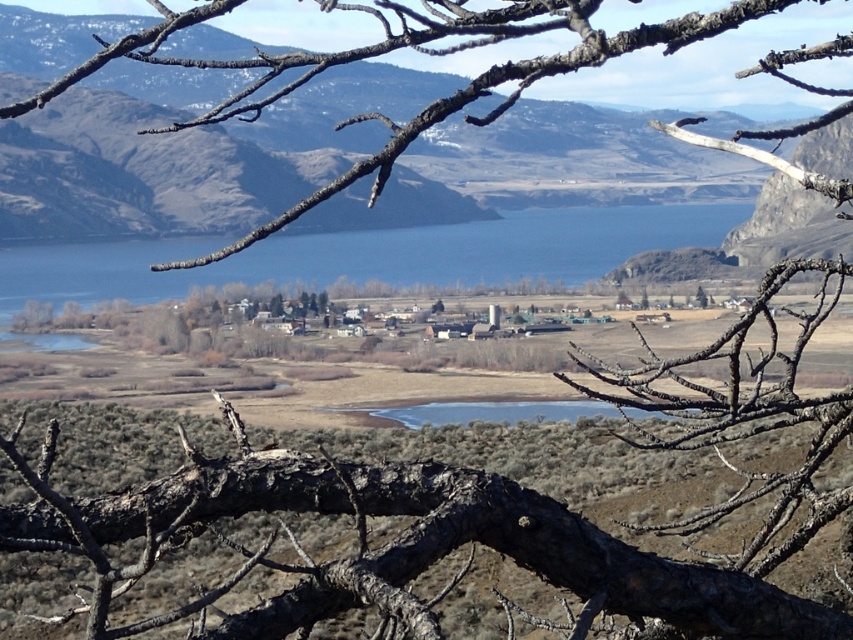
Question: Which of the following is the farthest from the observer?

Choices:
 (A) (165, 291)
 (B) (399, 419)
 (C) (354, 573)

Answer: (A)

Question: In this image, where is dark brown bark at center located relative to brown rough branch at upper center?

Choices:
 (A) left
 (B) right

Answer: (A)

Question: Which point is closer to the camera?

Choices:
 (A) (461, 26)
 (B) (419, 417)

Answer: (A)

Question: Is dark brown bark at center closer to camera compared to blue water at center?

Choices:
 (A) no
 (B) yes

Answer: (B)

Question: Which point appears closest to the camera in this image?

Choices:
 (A) (186, 60)
 (B) (688, 628)
 (C) (32, 262)

Answer: (B)

Question: Can you confirm if dark brown bark at center is positioned to the right of clear water at center?

Choices:
 (A) no
 (B) yes

Answer: (A)